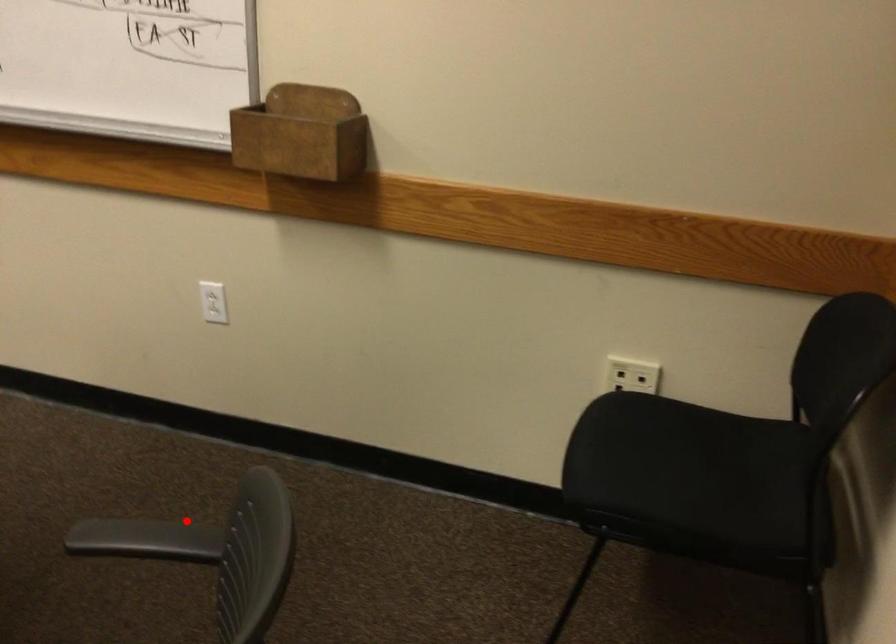
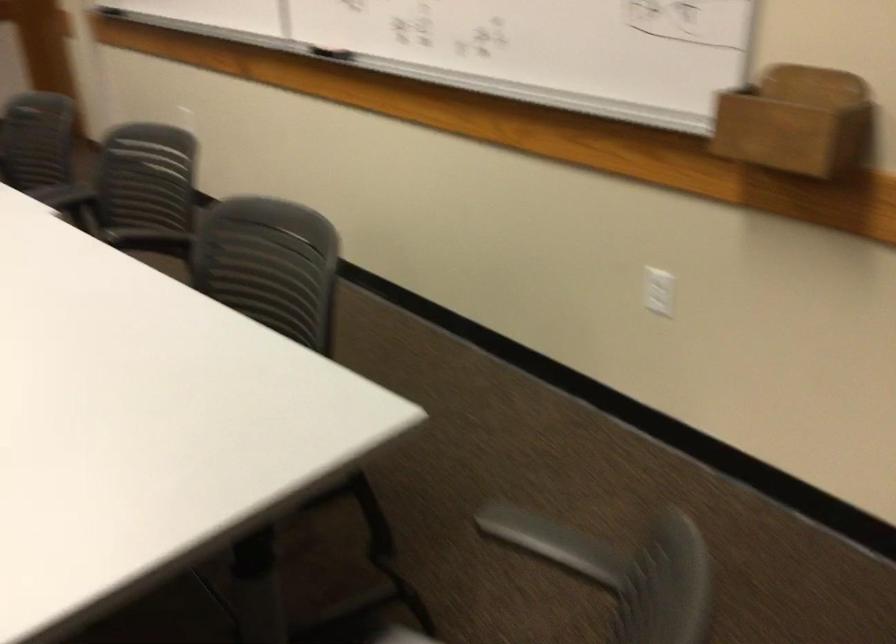
Locate, in the second image, the point that corresponds to the highlighted location in the first image.

(552, 538)